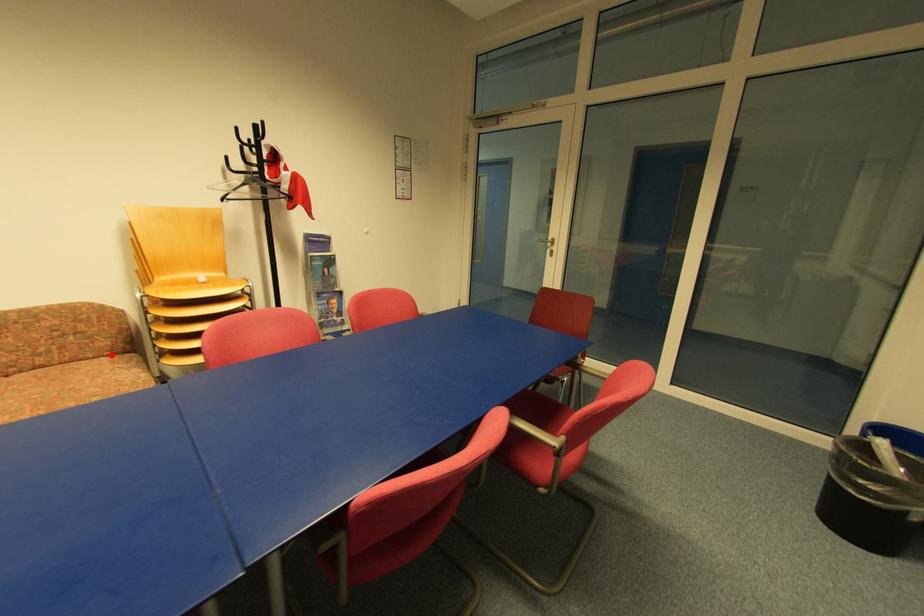
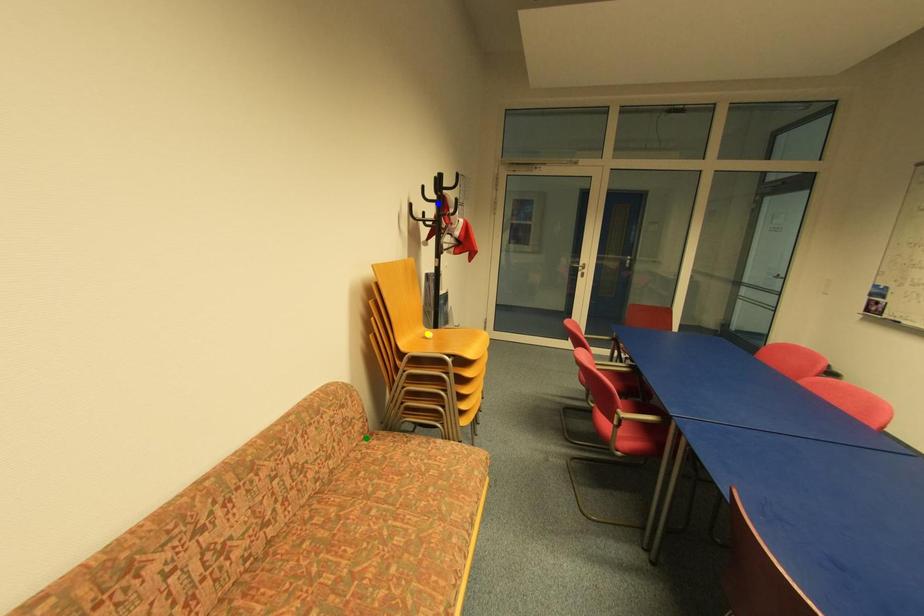
Question: I am providing you with two images of the same scene from different viewpoints. A red point is marked on the first image. You are given multiple points on the second image. Which spot in image 2 lines up with the point in image 1?

Choices:
 (A) green point
 (B) yellow point
 (C) blue point

Answer: (A)